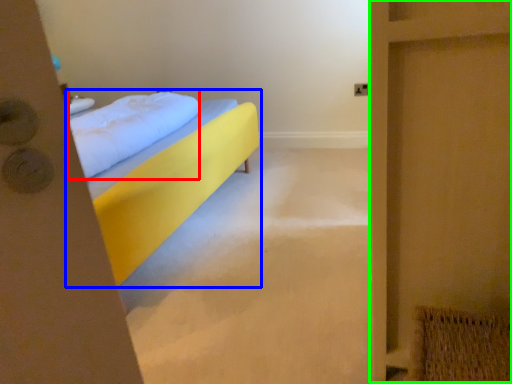
Question: Estimate the real-world distances between objects in this image. Which object is closer to pillow (highlighted by a red box), bed (highlighted by a blue box) or screen door (highlighted by a green box)?

Choices:
 (A) bed
 (B) screen door

Answer: (A)